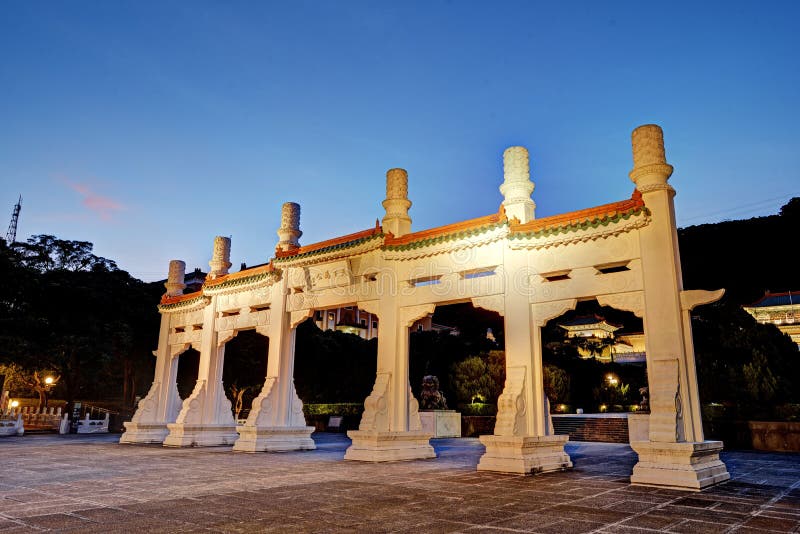
At what (x,y) coordinates should I click in order to perform the action: click on entryway base. Please return your answer as a coordinate pair (x, y). The height and width of the screenshot is (534, 800). Looking at the image, I should click on (150, 437), (206, 438), (270, 436), (402, 450), (546, 453), (693, 471).